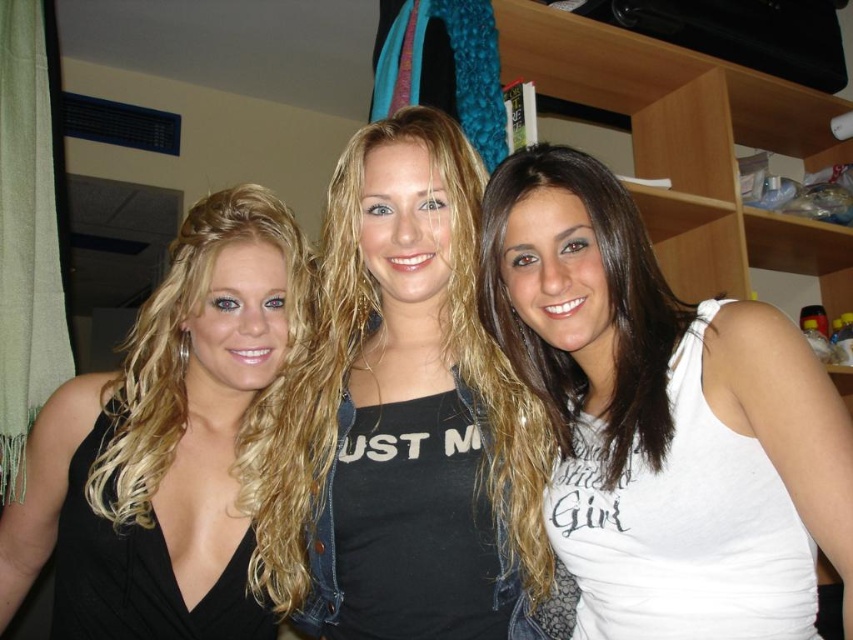
You are a photographer trying to capture a group photo of the three individuals. The two people in the middle are wearing the white matte tank top at center and the black matte tank top at center. You need to ensure there is at least 15 centimeters of space between their tank tops for the photo to look balanced. Based on the current setup, will the photo meet your requirement?

The white matte tank top at center and black matte tank top at center are 14.26 centimeters apart from each other, which is less than the required 15 centimeters. Therefore, the photo will not meet the requirement and the individuals need to adjust their positions to increase the distance between their tank tops.

You are a fashion designer observing the image. You need to determine the spatial relationship between the black matte dress at left and the white matte tank top at center. Which one is positioned lower in the image?

The black matte dress at left is located below the white matte tank top at center, so it is positioned lower in the image.

You are organizing a clothing store display and need to arrange the black matte dress at left and black matte tank top at center according to their positions in the image. Which clothing item should be placed lower on the display rack?

The black matte dress at left should be placed lower on the display rack because it is located below the black matte tank top at center in the image.